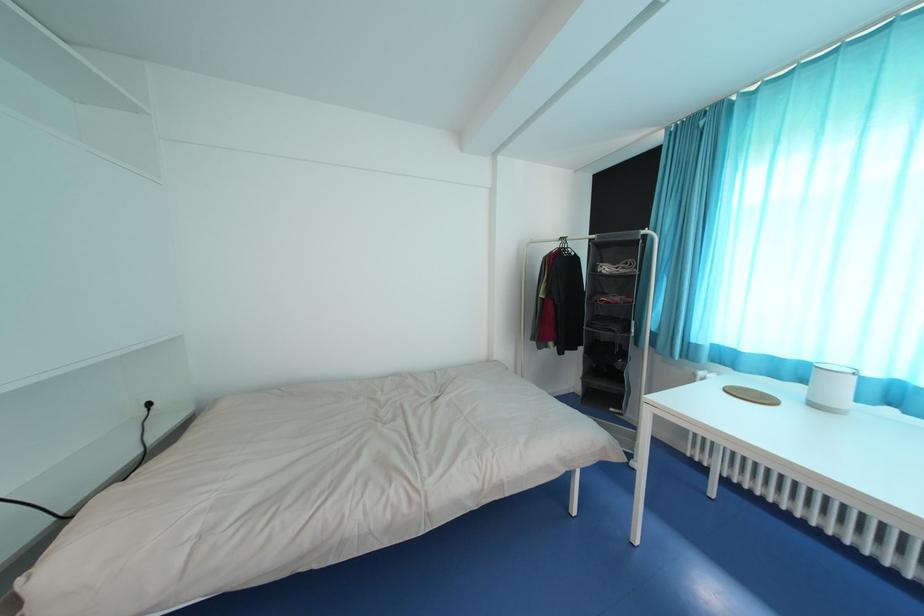
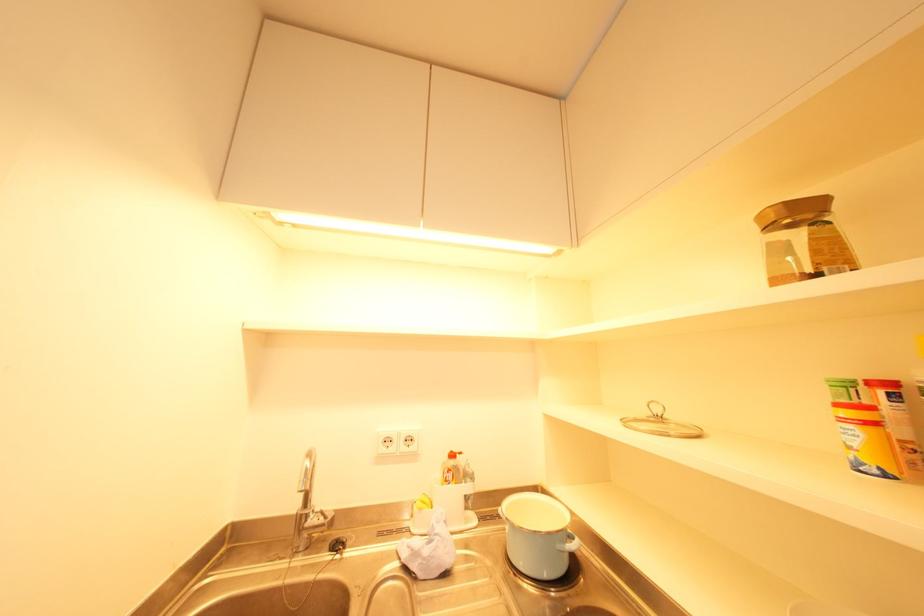
Question: Which direction would the cameraman need to move to produce the second image? Reply with the corresponding letter.

Choices:
 (A) Left
 (B) Right
 (C) Forward
 (D) Backward

Answer: (A)